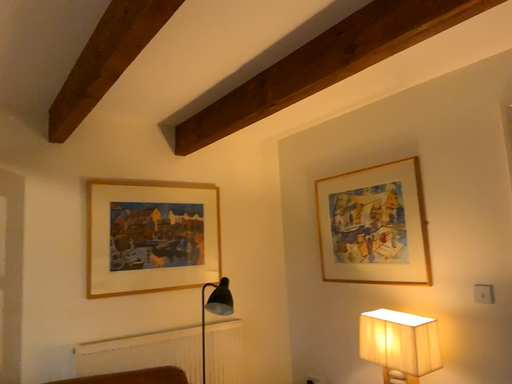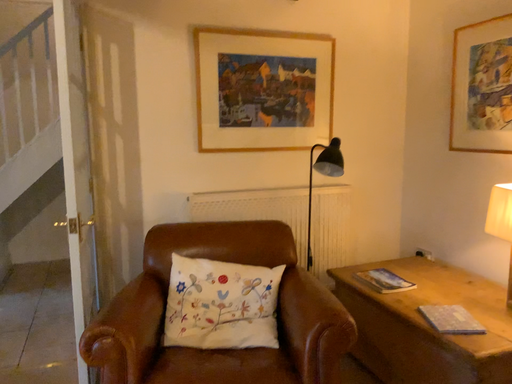
Question: Which way did the camera rotate in the video?

Choices:
 (A) rotated downward
 (B) rotated upward

Answer: (A)